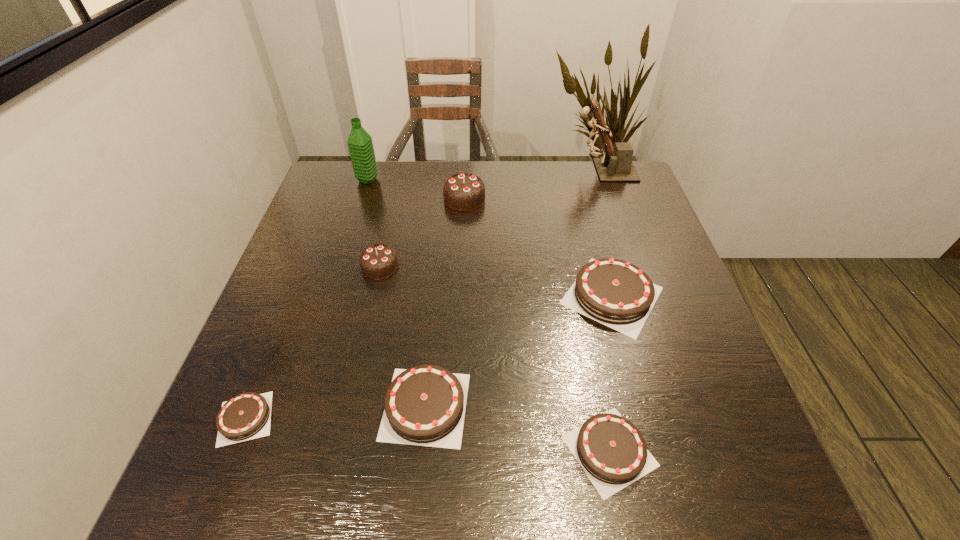
Locate an element on the screen. The image size is (960, 540). free space located 0.400m on the front of the smaller chocolate chocolate cake is located at coordinates (340, 446).

I want to click on free space located on the left of the farthest brown chocolate cake, so click(397, 295).

Locate an element on the screen. vacant space located 0.110m on the back of the third smallest brown chocolate cake is located at coordinates (433, 325).

Identify the location of free space located 0.200m on the back of the third biggest brown chocolate cake. Image resolution: width=960 pixels, height=540 pixels. (584, 323).

At what (x,y) coordinates should I click in order to perform the action: click on vacant space located 0.290m on the back of the smallest brown chocolate cake. Please return your answer as a coordinate pair (x, y). The image size is (960, 540). Looking at the image, I should click on (299, 282).

Where is `figurine positioned at the far edge`? This screenshot has width=960, height=540. figurine positioned at the far edge is located at coordinates (615, 164).

The width and height of the screenshot is (960, 540). Identify the location of water bottle that is positioned at the far edge. (360, 144).

Identify the location of chocolate cake positioned at the far edge. This screenshot has height=540, width=960. (463, 192).

Where is `object present at the near edge`? The width and height of the screenshot is (960, 540). object present at the near edge is located at coordinates (611, 450).

Identify the location of water bottle at the left edge. pyautogui.click(x=360, y=144).